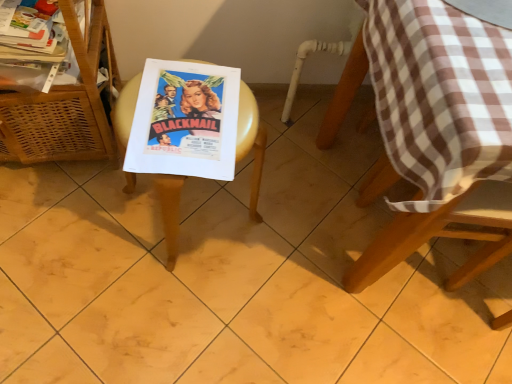
Question: From a real-world perspective, is brown checkered tablecloth at upper right physically above wooden picnic table at center?

Choices:
 (A) no
 (B) yes

Answer: (B)

Question: Considering the relative sizes of brown checkered tablecloth at upper right and wooden picnic table at center in the image provided, is brown checkered tablecloth at upper right bigger than wooden picnic table at center?

Choices:
 (A) yes
 (B) no

Answer: (B)

Question: From the image's perspective, would you say brown checkered tablecloth at upper right is shown under wooden picnic table at center?

Choices:
 (A) no
 (B) yes

Answer: (A)

Question: Does brown checkered tablecloth at upper right have a lesser height compared to wooden picnic table at center?

Choices:
 (A) no
 (B) yes

Answer: (B)

Question: Considering the relative sizes of brown checkered tablecloth at upper right and wooden picnic table at center in the image provided, is brown checkered tablecloth at upper right wider than wooden picnic table at center?

Choices:
 (A) yes
 (B) no

Answer: (A)

Question: From their relative heights in the image, would you say brown checkered tablecloth at upper right is taller or shorter than woven wood basket at left?

Choices:
 (A) short
 (B) tall

Answer: (A)

Question: Is brown checkered tablecloth at upper right situated inside woven wood basket at left or outside?

Choices:
 (A) inside
 (B) outside

Answer: (B)

Question: Considering the positions of point (477, 13) and point (56, 134), is point (477, 13) closer or farther from the camera than point (56, 134)?

Choices:
 (A) closer
 (B) farther

Answer: (A)

Question: Is brown checkered tablecloth at upper right in front of or behind woven wood basket at left in the image?

Choices:
 (A) behind
 (B) front

Answer: (B)

Question: Based on their positions, is woven wood basket at left located to the left or right of matte paper poster at center?

Choices:
 (A) right
 (B) left

Answer: (B)

Question: In terms of size, does woven wood basket at left appear bigger or smaller than matte paper poster at center?

Choices:
 (A) small
 (B) big

Answer: (B)

Question: Is woven wood basket at left inside or outside of matte paper poster at center?

Choices:
 (A) inside
 (B) outside

Answer: (B)

Question: Is woven wood basket at left wider or thinner than matte paper poster at center?

Choices:
 (A) wide
 (B) thin

Answer: (A)

Question: Considering the positions of point (510, 24) and point (186, 87), is point (510, 24) closer or farther from the camera than point (186, 87)?

Choices:
 (A) farther
 (B) closer

Answer: (B)

Question: From a real-world perspective, is brown checkered tablecloth at upper right positioned above or below matte paper poster at center?

Choices:
 (A) above
 (B) below

Answer: (A)